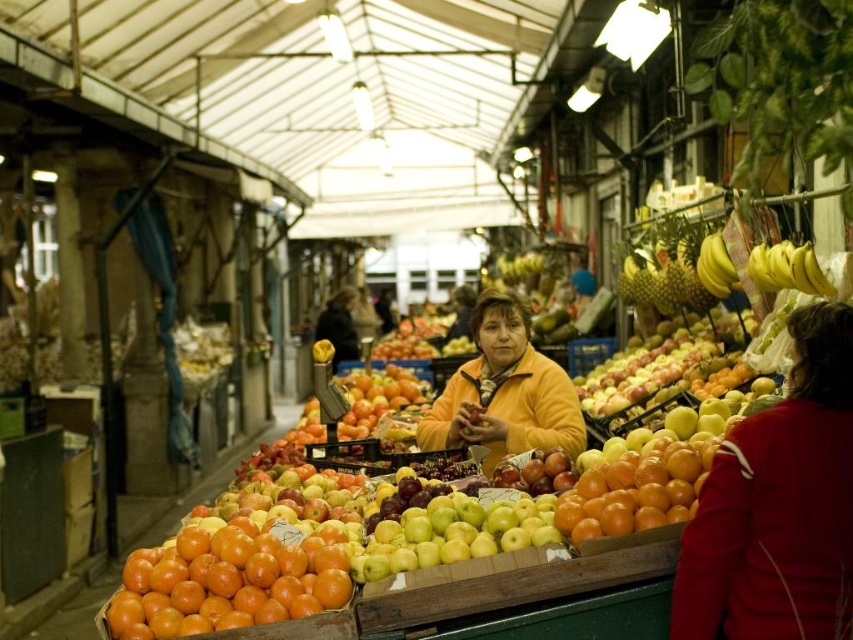
Question: Can you confirm if glossy orange oranges at lower left is positioned to the right of shiny orange oranges at center?

Choices:
 (A) no
 (B) yes

Answer: (A)

Question: Is orange fleece jacket at center to the right of shiny orange oranges at center from the viewer's perspective?

Choices:
 (A) no
 (B) yes

Answer: (A)

Question: Which point is closer to the camera?

Choices:
 (A) (270, 564)
 (B) (795, 275)
 (C) (666, 476)
 (D) (694, 632)

Answer: (D)

Question: Which of the following is the closest to the observer?

Choices:
 (A) shiny orange oranges at center
 (B) orange fleece jacket at center

Answer: (A)

Question: From the image, what is the correct spatial relationship of red fleece jacket at lower right in relation to shiny orange oranges at center?

Choices:
 (A) left
 (B) right

Answer: (B)

Question: Among these objects, which one is farthest from the camera?

Choices:
 (A) glossy orange oranges at lower left
 (B) red fleece jacket at lower right

Answer: (A)